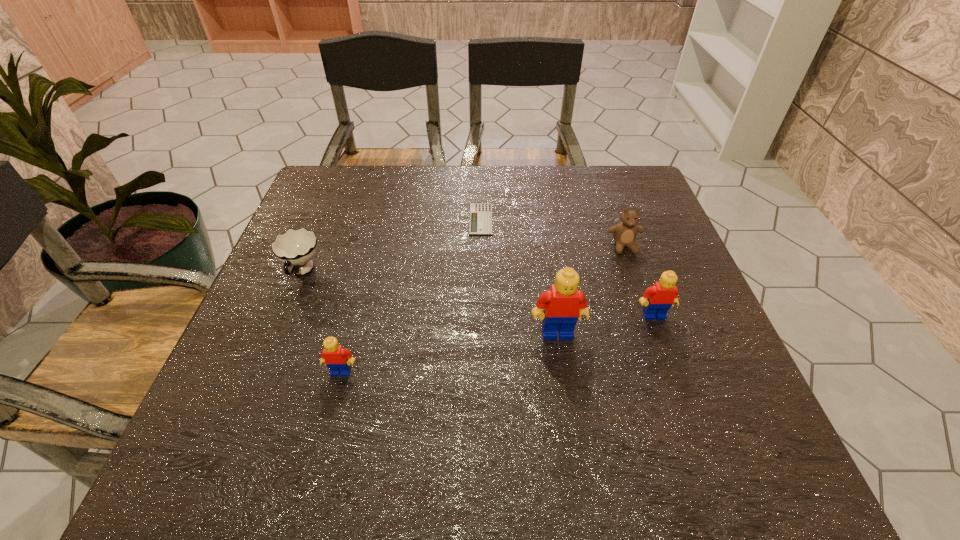
At what (x,y) coordinates should I click in order to perform the action: click on teddy bear. Please return your answer as a coordinate pair (x, y). The width and height of the screenshot is (960, 540). Looking at the image, I should click on (624, 233).

Find the location of a particular element. free point located 0.100m on the face of the fifth farthest object is located at coordinates (565, 385).

At what (x,y) coordinates should I click in order to perform the action: click on vacant space positioned 0.220m on the face of the second tallest object. Please return your answer as a coordinate pair (x, y). Image resolution: width=960 pixels, height=540 pixels. Looking at the image, I should click on (691, 419).

Identify the location of blank area located 0.180m on the left of the shortest object. (401, 219).

Find the location of a particular element. Image resolution: width=960 pixels, height=540 pixels. blank area located 0.210m on the side of the fifth tallest object with the handle is located at coordinates (261, 372).

Where is `vacant area located 0.300m on the front-facing side of the teddy bear`? This screenshot has width=960, height=540. vacant area located 0.300m on the front-facing side of the teddy bear is located at coordinates (663, 360).

Find the location of a particular element. This screenshot has height=540, width=960. object that is positioned at the far edge is located at coordinates (480, 220).

Where is `object at the near edge`? object at the near edge is located at coordinates (337, 359).

At what (x,y) coordinates should I click in order to perform the action: click on object located in the left edge section of the desktop. Please return your answer as a coordinate pair (x, y). The width and height of the screenshot is (960, 540). Looking at the image, I should click on (296, 247).

This screenshot has width=960, height=540. I want to click on Lego that is at the right edge, so click(658, 299).